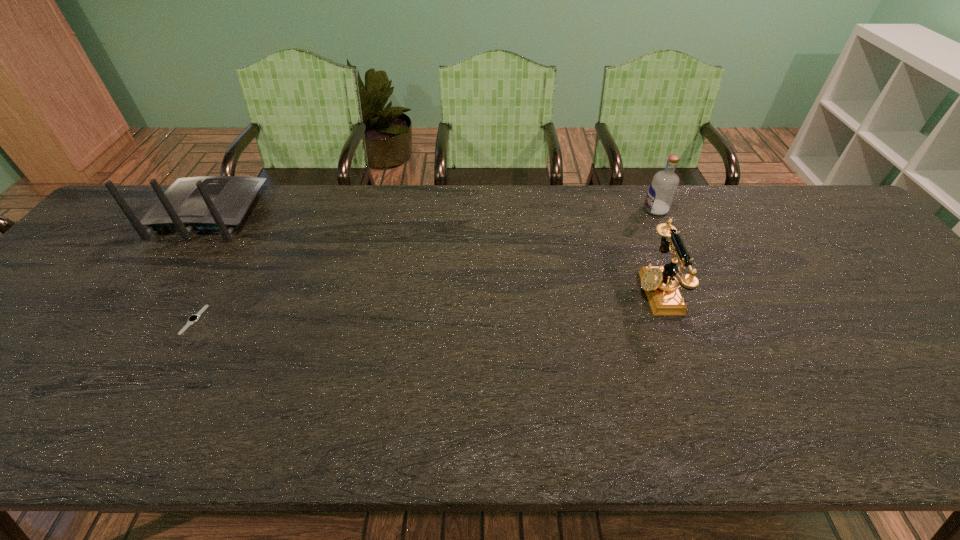
I want to click on router, so click(x=207, y=203).

Where is `the rightmost object`? The height and width of the screenshot is (540, 960). the rightmost object is located at coordinates (663, 187).

What are the coordinates of `the second object from right to left` in the screenshot? It's located at (660, 284).

The width and height of the screenshot is (960, 540). Identify the location of watch. (192, 319).

Identify the location of free space located on the label of the rightmost object. This screenshot has width=960, height=540. (523, 210).

Where is `vacant space located on the label of the rightmost object`? vacant space located on the label of the rightmost object is located at coordinates (563, 210).

At what (x,y) coordinates should I click in order to perform the action: click on vacant space located 0.160m on the label of the rightmost object. Please return your answer as a coordinate pair (x, y). The height and width of the screenshot is (540, 960). Looking at the image, I should click on (591, 210).

The width and height of the screenshot is (960, 540). Identify the location of free space located on the dial of the second object from right to left. (481, 292).

Image resolution: width=960 pixels, height=540 pixels. I want to click on vacant space situated 0.360m on the dial of the second object from right to left, so click(496, 292).

The height and width of the screenshot is (540, 960). Find the location of `free location located 0.260m on the dial of the second object from right to left`. free location located 0.260m on the dial of the second object from right to left is located at coordinates (536, 292).